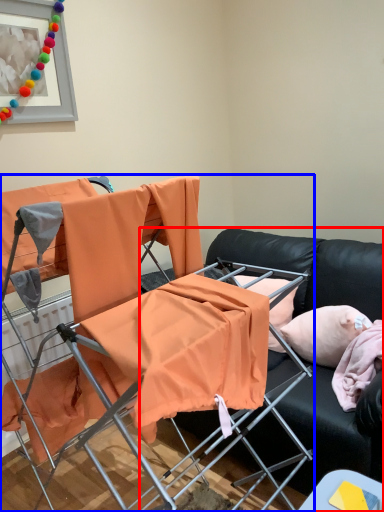
Question: Among these objects, which one is farthest to the camera, studio couch (highlighted by a red box) or chair (highlighted by a blue box)?

Choices:
 (A) studio couch
 (B) chair

Answer: (A)